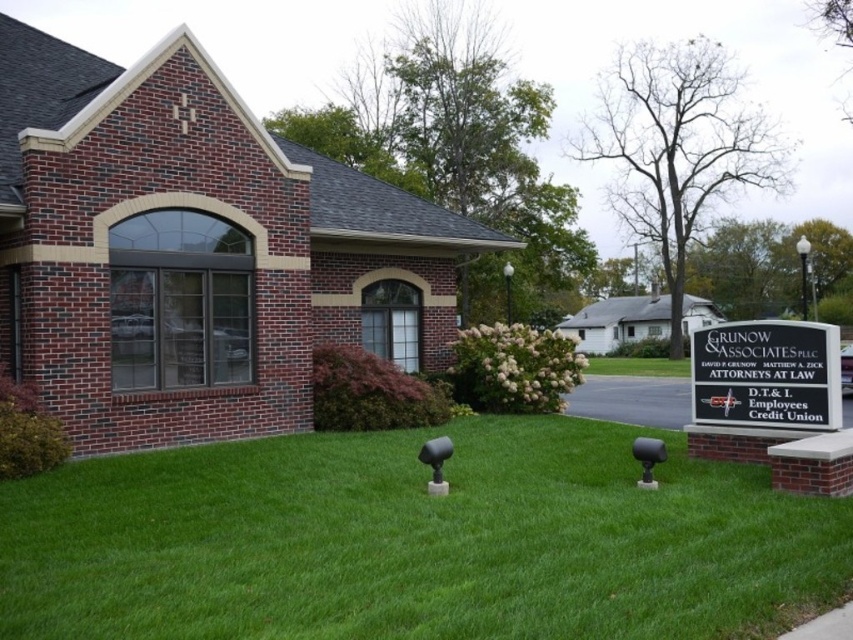
Question: Can you confirm if green grass at center is positioned to the left of black plastic sign at lower right?

Choices:
 (A) no
 (B) yes

Answer: (B)

Question: Which of the following is the farthest from the observer?

Choices:
 (A) green grass at center
 (B) black plastic sign at lower right

Answer: (B)

Question: Where is green grass at center located in relation to black plastic sign at lower right in the image?

Choices:
 (A) below
 (B) above

Answer: (A)

Question: Is green grass at center below black plastic sign at lower right?

Choices:
 (A) yes
 (B) no

Answer: (A)

Question: Which point appears closest to the camera in this image?

Choices:
 (A) (308, 532)
 (B) (764, 378)

Answer: (A)